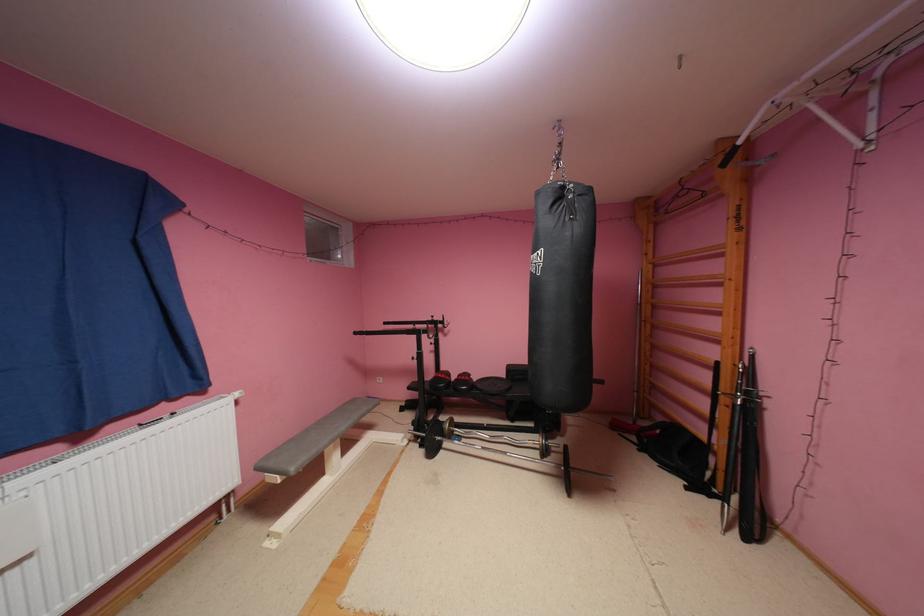
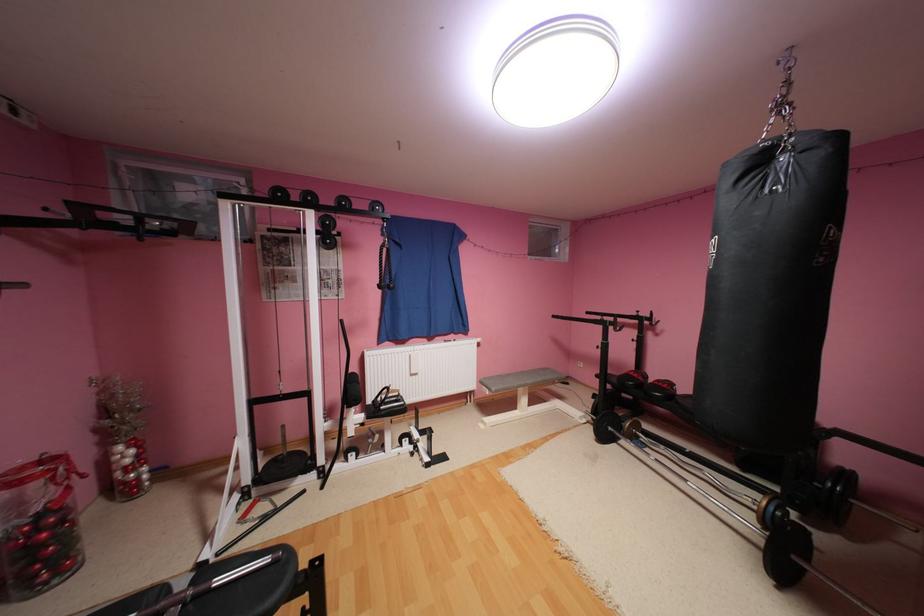
Where in the second image is the point corresponding to (x=568, y=193) from the first image?

(769, 161)